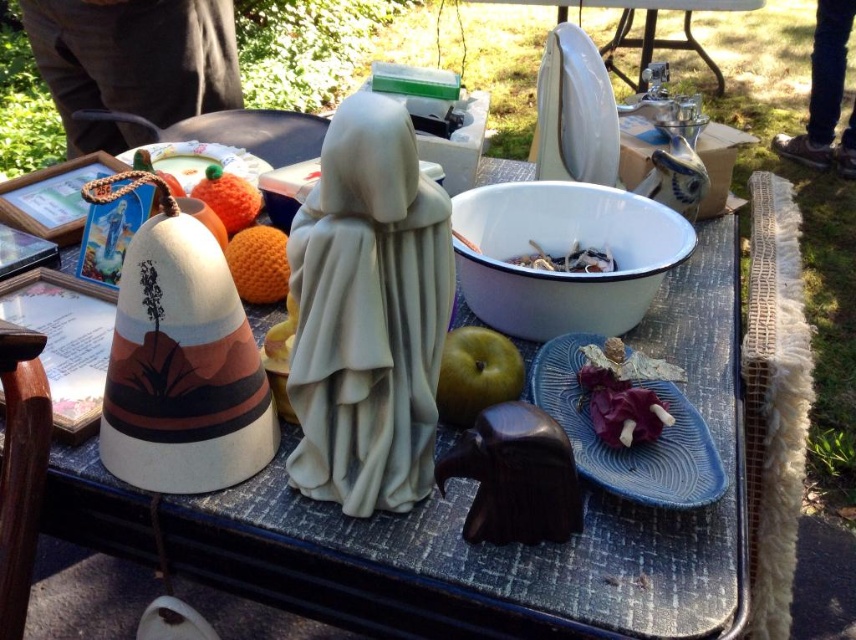
You are a vendor at the flea market and need to place a new item between the purple matte fabric at center and the orange fuzzy ball at upper center. The item you have is 50 centimeters wide. Will there be enough space between them to fit it?

The distance between the purple matte fabric at center and the orange fuzzy ball at upper center is 50.63 centimeters. Since the item is 50 centimeters wide, there is enough space to fit it between them.

You are setting up a display at a flea market and want to arrange the purple matte fabric at center and orange fuzzy ball at upper center so that the taller item is placed at the back for visibility. Which item should you place at the back?

The orange fuzzy ball at upper center should be placed at the back because it is taller than the purple matte fabric at center.

You are at a flea market and see the white matte statue at center on a table. If you want to place a small decorative item to the right of it, where should you position it?

You should place the small decorative item to the right of the white matte statue at center, which is located at coordinates approximately 0.491 on the x and 0.431 on the y axis.